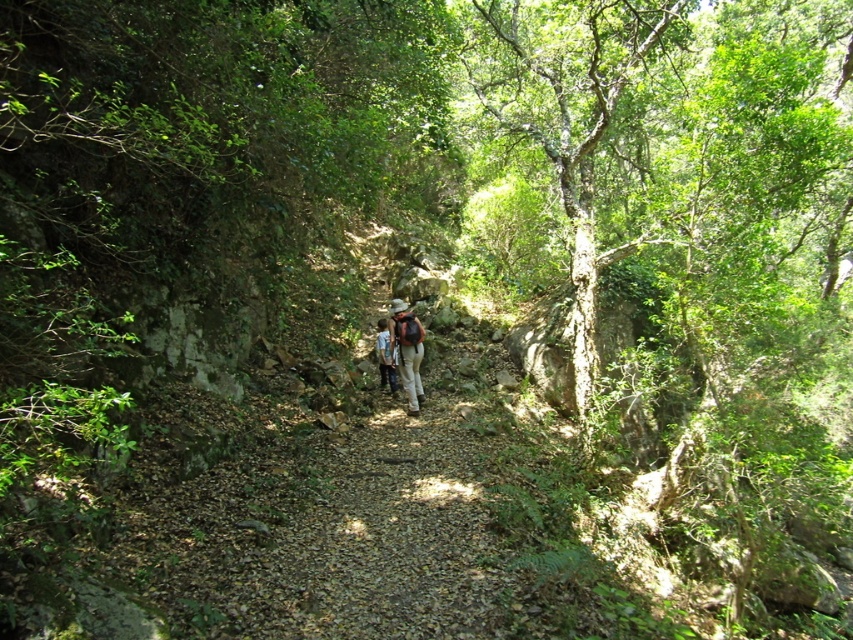
You are a hiker walking on a forest path. You notice a matte brown backpack at center and blue denim jeans at center. How far apart are these two items?

The matte brown backpack at center is 19.43 inches away from the blue denim jeans at center.

You are a hiker trying to pass through the forest path. You notice a green rough bark tree at center and blue denim jeans at center. Which object is wider?

The green rough bark tree at center is wider than the blue denim jeans at center.